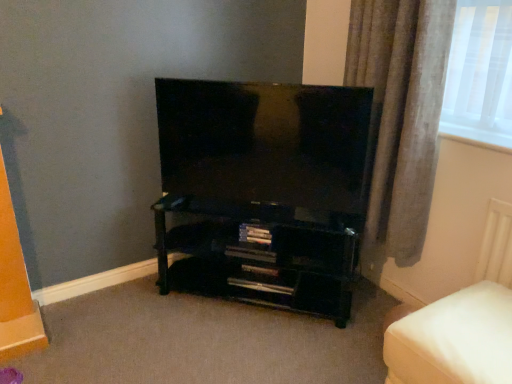
Question: Is black glossy shelf at lower center closer to camera compared to white fabric ottoman at lower right?

Choices:
 (A) yes
 (B) no

Answer: (B)

Question: Is black glossy shelf at lower center thinner than white fabric ottoman at lower right?

Choices:
 (A) no
 (B) yes

Answer: (B)

Question: Considering the relative sizes of black glossy shelf at lower center and white fabric ottoman at lower right in the image provided, is black glossy shelf at lower center smaller than white fabric ottoman at lower right?

Choices:
 (A) yes
 (B) no

Answer: (B)

Question: Does black glossy shelf at lower center have a lesser height compared to white fabric ottoman at lower right?

Choices:
 (A) no
 (B) yes

Answer: (A)

Question: From the image's perspective, would you say black glossy shelf at lower center is positioned over white fabric ottoman at lower right?

Choices:
 (A) no
 (B) yes

Answer: (B)

Question: In terms of width, does white fabric ottoman at lower right look wider or thinner when compared to gray fabric curtain at right?

Choices:
 (A) wide
 (B) thin

Answer: (A)

Question: From their relative heights in the image, would you say white fabric ottoman at lower right is taller or shorter than gray fabric curtain at right?

Choices:
 (A) tall
 (B) short

Answer: (B)

Question: Relative to gray fabric curtain at right, is white fabric ottoman at lower right in front or behind?

Choices:
 (A) behind
 (B) front

Answer: (B)

Question: From the image's perspective, relative to gray fabric curtain at right, is white fabric ottoman at lower right above or below?

Choices:
 (A) below
 (B) above

Answer: (A)

Question: Is black glossy shelf at lower center to the left or to the right of black glossy tv at center in the image?

Choices:
 (A) right
 (B) left

Answer: (B)

Question: Looking at the image, does black glossy shelf at lower center seem bigger or smaller compared to black glossy tv at center?

Choices:
 (A) big
 (B) small

Answer: (A)

Question: Choose the correct answer: Is black glossy shelf at lower center inside black glossy tv at center or outside it?

Choices:
 (A) outside
 (B) inside

Answer: (A)

Question: Relative to black glossy tv at center, is black glossy shelf at lower center in front or behind?

Choices:
 (A) front
 (B) behind

Answer: (B)

Question: From a real-world perspective, is black glossy tv at center above or below black glossy shelf at lower center?

Choices:
 (A) below
 (B) above

Answer: (B)

Question: Is black glossy tv at center to the left or to the right of black glossy shelf at lower center in the image?

Choices:
 (A) right
 (B) left

Answer: (A)